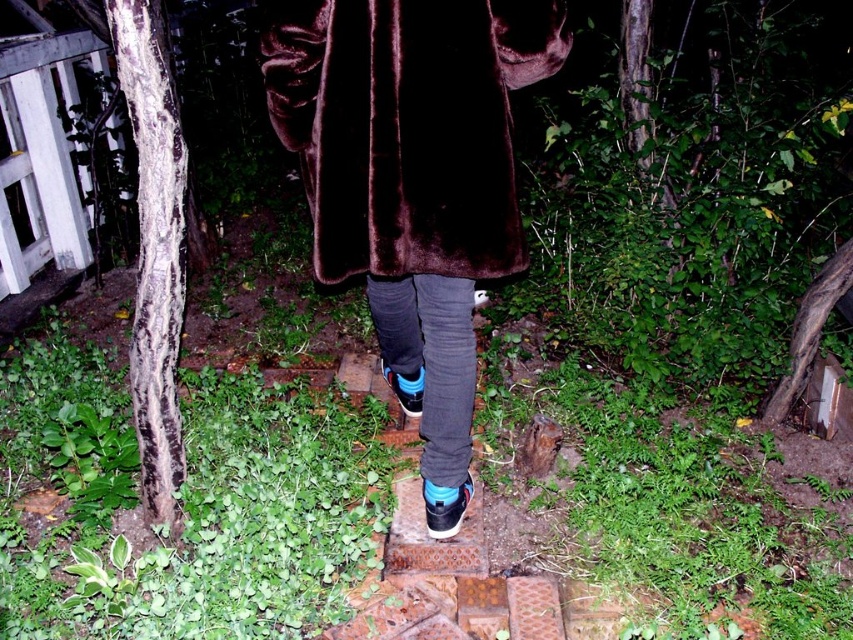
In the scene shown: You are a photographer trying to capture both the shiny black sneaker at center and the suede black shoe at center in a single shot. Which shoe should you focus on to ensure both are in sharp focus?

You should focus on the shiny black sneaker at center because it is closer to the viewer, and focusing on the closer object will keep both shoes in focus due to the depth of field.

You are a photographer trying to capture the person walking on the steps. You notice both the shiny black sneaker at center and the suede black shoe at center. Which one is closer to the camera?

The shiny black sneaker at center is shorter than the suede black shoe at center, so the shorter object would be closer to the camera.

You are a delivery person who needs to carefully step over the steps to avoid damaging the velvety brown coat at center and the suede black shoe at center. What is the minimum width of the path you should maintain between your feet and these items to ensure safety?

The minimum width you should maintain is 93.50 centimeters between your feet and the velvety brown coat at center and suede black shoe at center to ensure safety.